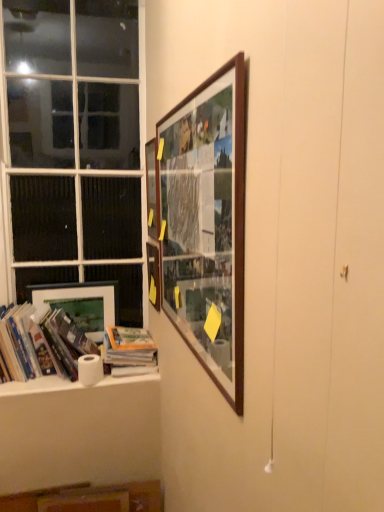
Where is `empty space that is ontop of white paper towel at lower left (from a real-world perspective)`? The height and width of the screenshot is (512, 384). empty space that is ontop of white paper towel at lower left (from a real-world perspective) is located at coordinates (76, 375).